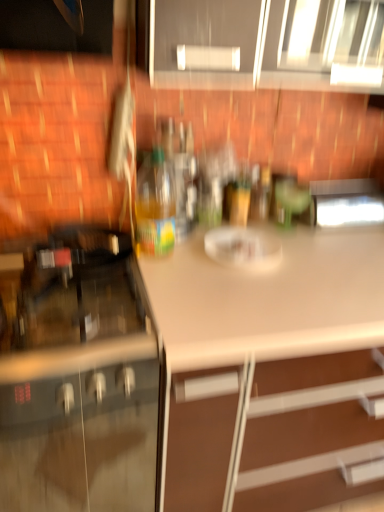
At what (x,y) coordinates should I click in order to perform the action: click on free space in front of translucent plastic bottle at center. Please return your answer as a coordinate pair (x, y). This screenshot has width=384, height=512. Looking at the image, I should click on (172, 275).